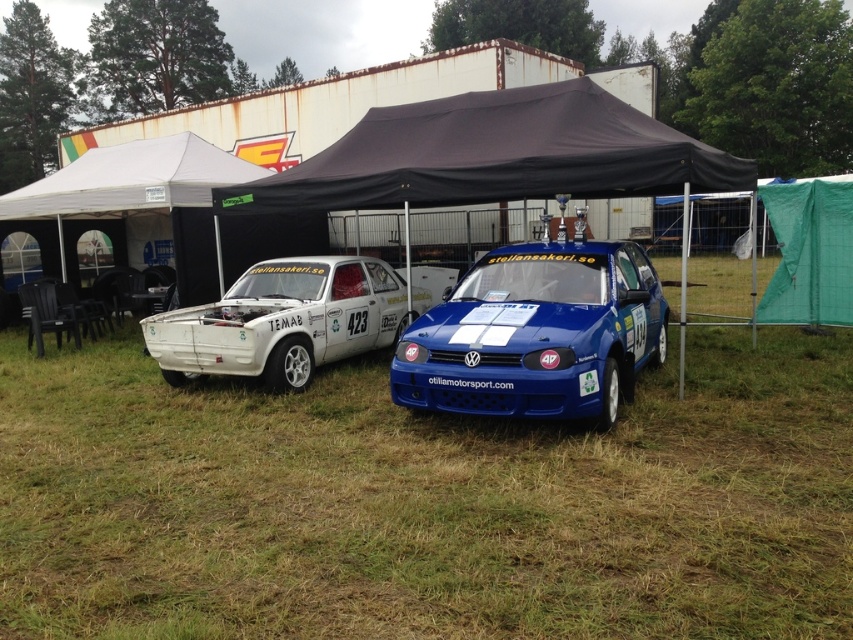
The height and width of the screenshot is (640, 853). Describe the element at coordinates (425, 502) in the screenshot. I see `green grass at center` at that location.

Which is in front, point (106, 436) or point (509, 362)?

Point (509, 362) is more forward.

This screenshot has width=853, height=640. Identify the location of green grass at center. click(x=425, y=502).

Does green grass at center lie in front of white matte rally car at left?

Yes, it is.

Does green grass at center appear on the right side of white matte rally car at left?

Correct, you'll find green grass at center to the right of white matte rally car at left.

Measure the distance between green grass at center and camera.

A distance of 3.32 meters exists between green grass at center and camera.

This screenshot has width=853, height=640. I want to click on green grass at center, so click(x=425, y=502).

Identify the location of blue glossy hatchback at center. (537, 333).

How distant is blue glossy hatchback at center from white matte rally car at left?

blue glossy hatchback at center is 2.52 meters from white matte rally car at left.

Is point (496, 381) less distant than point (303, 294)?

Yes, it is in front of point (303, 294).

Image resolution: width=853 pixels, height=640 pixels. Identify the location of blue glossy hatchback at center. [x=537, y=333].